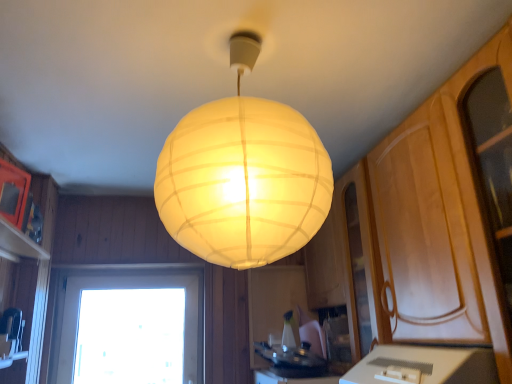
Question: From a real-world perspective, is white paper lampshade at center on top of transparent glass window at lower left?

Choices:
 (A) no
 (B) yes

Answer: (B)

Question: Does white paper lampshade at center lie in front of transparent glass window at lower left?

Choices:
 (A) yes
 (B) no

Answer: (A)

Question: Is white paper lampshade at center aimed at transparent glass window at lower left?

Choices:
 (A) no
 (B) yes

Answer: (A)

Question: Would you say white paper lampshade at center is outside transparent glass window at lower left?

Choices:
 (A) no
 (B) yes

Answer: (B)

Question: From a real-world perspective, is white paper lampshade at center under transparent glass window at lower left?

Choices:
 (A) yes
 (B) no

Answer: (B)

Question: Can you confirm if white paper lampshade at center is taller than transparent glass window at lower left?

Choices:
 (A) yes
 (B) no

Answer: (B)

Question: From the image's perspective, is white glossy countertop at lower center located beneath transparent glass window at lower left?

Choices:
 (A) no
 (B) yes

Answer: (A)

Question: Is white glossy countertop at lower center outside transparent glass window at lower left?

Choices:
 (A) yes
 (B) no

Answer: (A)

Question: Are white glossy countertop at lower center and transparent glass window at lower left beside each other?

Choices:
 (A) yes
 (B) no

Answer: (B)

Question: From a real-world perspective, is white glossy countertop at lower center beneath transparent glass window at lower left?

Choices:
 (A) no
 (B) yes

Answer: (B)

Question: Considering the relative sizes of white glossy countertop at lower center and transparent glass window at lower left in the image provided, is white glossy countertop at lower center bigger than transparent glass window at lower left?

Choices:
 (A) no
 (B) yes

Answer: (B)

Question: Are white glossy countertop at lower center and transparent glass window at lower left far apart?

Choices:
 (A) no
 (B) yes

Answer: (B)

Question: Can you confirm if transparent glass window at lower left is taller than white paper lampshade at center?

Choices:
 (A) no
 (B) yes

Answer: (B)